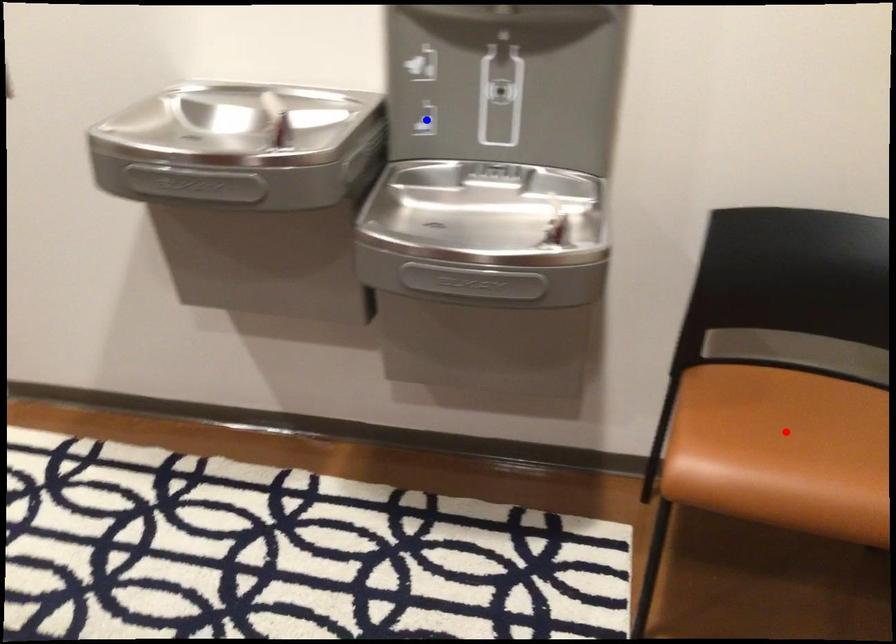
Question: In the image, two points are highlighted. Which point is nearer to the camera? Reply with the corresponding letter.

Choices:
 (A) blue point
 (B) red point

Answer: (B)